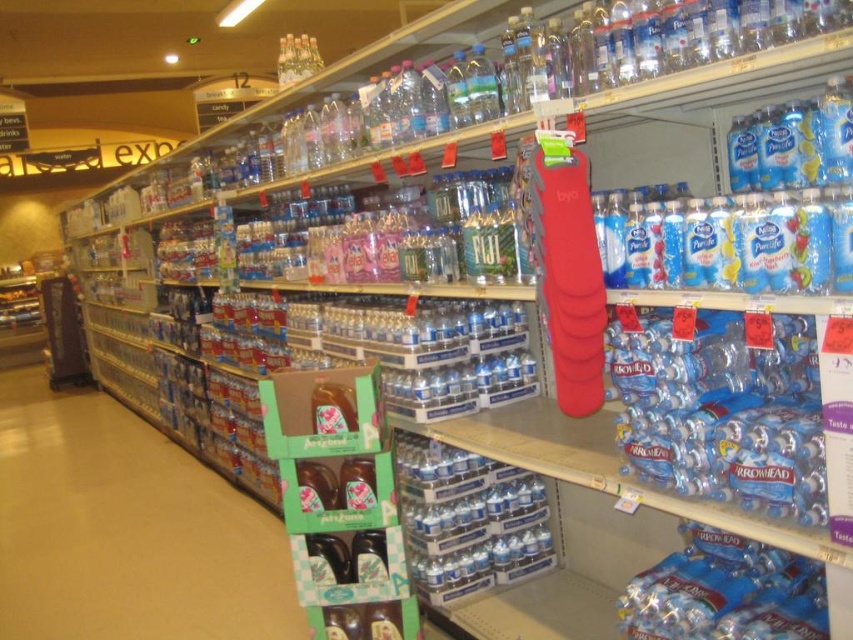
Question: Estimate the real-world distances between objects in this image. Which object is closer to the green cardboard box at lower left?

Choices:
 (A) translucent plastic water bottle at center
 (B) clear glass bottles at upper center

Answer: (A)

Question: Among these points, which one is nearest to the camera?

Choices:
 (A) (704, 368)
 (B) (229, 484)
 (C) (321, 61)

Answer: (A)

Question: Is green cardboard box at lower left smaller than clear glass bottles at upper center?

Choices:
 (A) yes
 (B) no

Answer: (B)

Question: Which is farther from the clear glass bottles at upper center?

Choices:
 (A) green cardboard box at lower left
 (B) translucent plastic water bottle at center

Answer: (A)

Question: In this image, where is translucent plastic water bottle at center located relative to clear glass bottles at upper center?

Choices:
 (A) above
 (B) below

Answer: (B)

Question: Can you confirm if green cardboard box at lower left is thinner than translucent plastic water bottle at center?

Choices:
 (A) yes
 (B) no

Answer: (B)